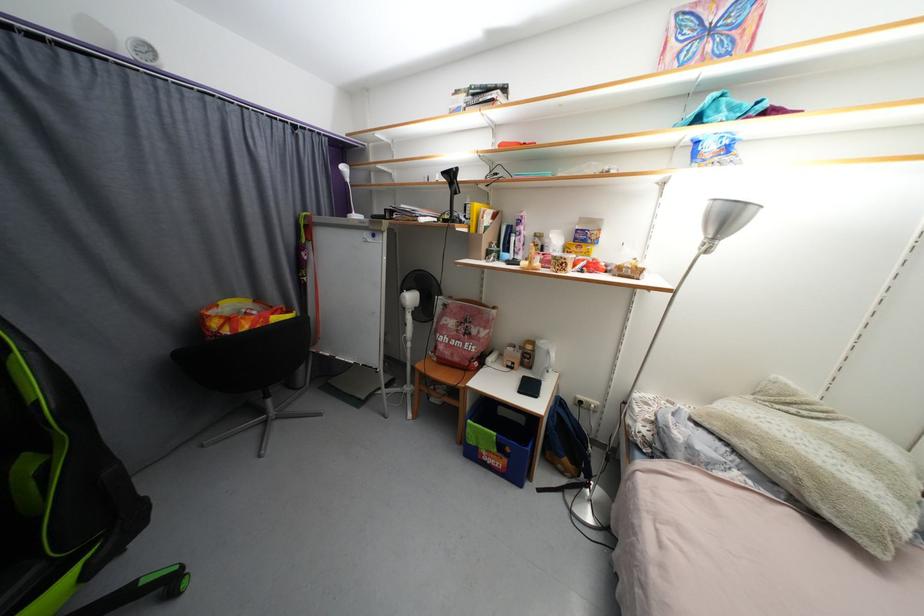
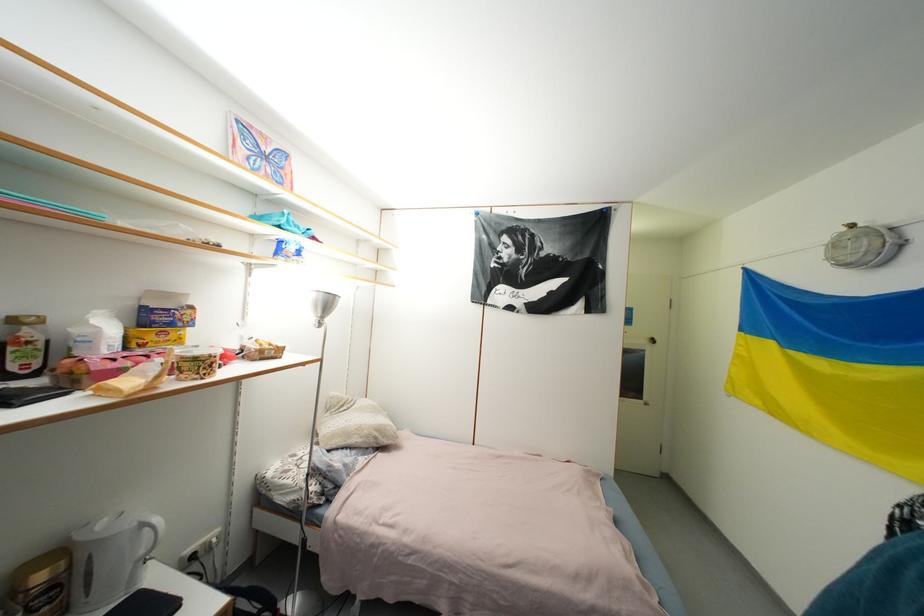
The point at (553, 354) is marked in the first image. Where is the corresponding point in the second image?

(149, 528)